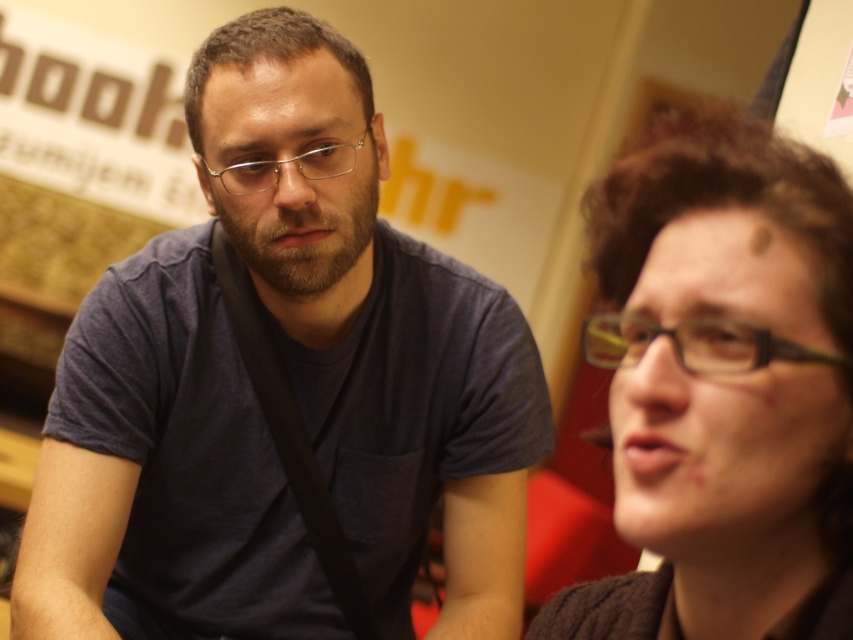
Is clear plastic glasses at right to the right of metallic frame glasses at center from the viewer's perspective?

Indeed, clear plastic glasses at right is positioned on the right side of metallic frame glasses at center.

Is clear plastic glasses at right wider than metallic frame glasses at center?

In fact, clear plastic glasses at right might be narrower than metallic frame glasses at center.

This screenshot has width=853, height=640. What do you see at coordinates (693, 344) in the screenshot?
I see `clear plastic glasses at right` at bounding box center [693, 344].

Where is `clear plastic glasses at right`? clear plastic glasses at right is located at coordinates (693, 344).

The image size is (853, 640). What do you see at coordinates (281, 388) in the screenshot?
I see `dark blue t-shirt at left` at bounding box center [281, 388].

Is point (337, 227) positioned before point (697, 300)?

No, (337, 227) is behind (697, 300).

Locate an element on the screen. The image size is (853, 640). dark blue t-shirt at left is located at coordinates (281, 388).

Is matte black hair at right to the left of metallic frame glasses at center from the viewer's perspective?

No, matte black hair at right is not to the left of metallic frame glasses at center.

Can you confirm if matte black hair at right is bigger than metallic frame glasses at center?

Indeed, matte black hair at right has a larger size compared to metallic frame glasses at center.

What do you see at coordinates (724, 388) in the screenshot? I see `matte black hair at right` at bounding box center [724, 388].

I want to click on matte black hair at right, so click(724, 388).